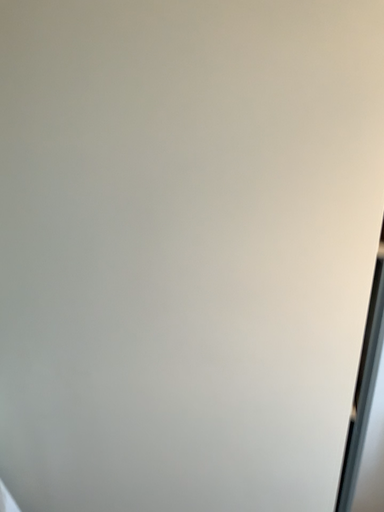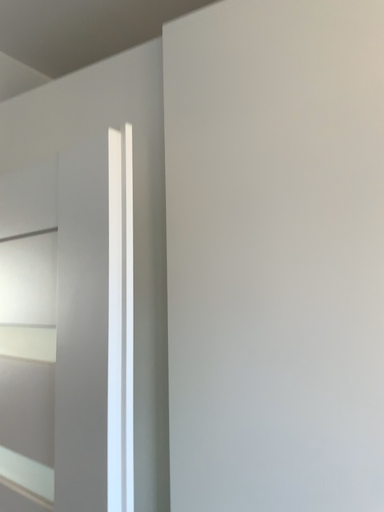
Question: How did the camera likely rotate when shooting the video?

Choices:
 (A) rotated right
 (B) rotated left

Answer: (B)